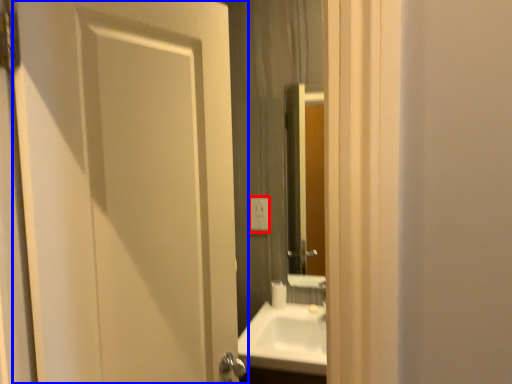
Question: Which object appears closest to the camera in this image, electric outlet (highlighted by a red box) or door (highlighted by a blue box)?

Choices:
 (A) electric outlet
 (B) door

Answer: (B)